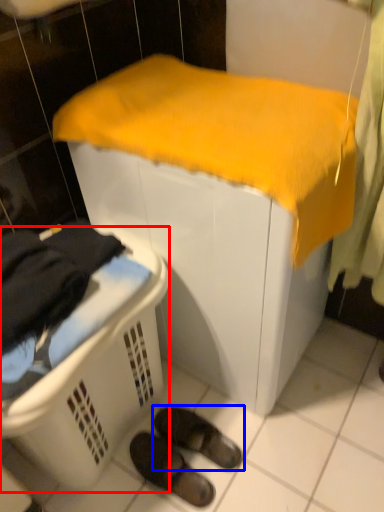
Question: Among these objects, which one is farthest to the camera, laundry basket (highlighted by a red box) or footwear (highlighted by a blue box)?

Choices:
 (A) laundry basket
 (B) footwear

Answer: (B)